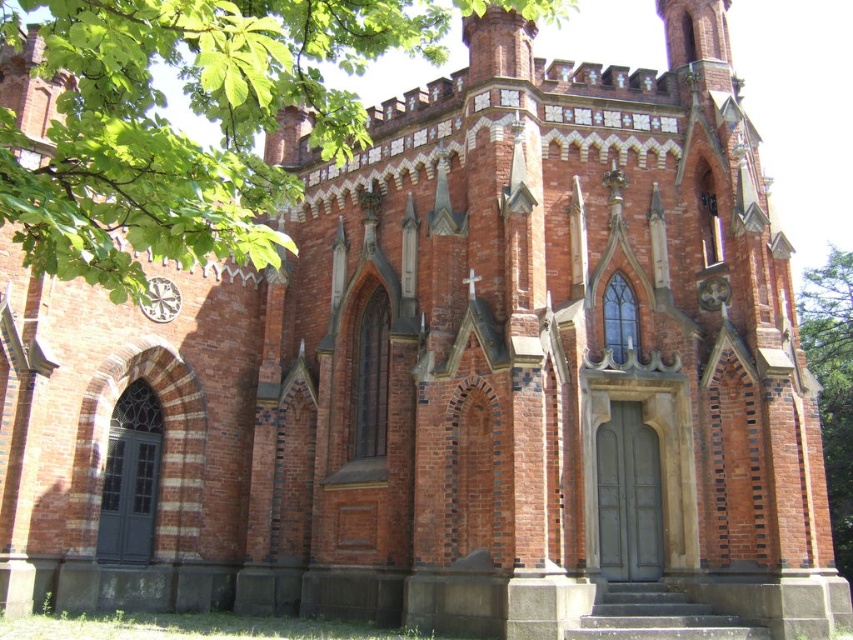
Question: Which object is closer to the camera taking this photo?

Choices:
 (A) white ceramic clock at center
 (B) green leafy tree at right
 (C) green leafy tree at upper left

Answer: (C)

Question: Based on their relative distances, which object is nearer to the green leafy tree at upper left?

Choices:
 (A) white ceramic clock at center
 (B) green leafy tree at right

Answer: (A)

Question: Does green leafy tree at upper left have a larger size compared to green leafy tree at right?

Choices:
 (A) yes
 (B) no

Answer: (A)

Question: Can you confirm if green leafy tree at upper left is positioned above white ceramic clock at center?

Choices:
 (A) no
 (B) yes

Answer: (B)

Question: Estimate the real-world distances between objects in this image. Which object is farther from the green leafy tree at right?

Choices:
 (A) green leafy tree at upper left
 (B) white ceramic clock at center

Answer: (B)

Question: Can you confirm if green leafy tree at right is positioned below white ceramic clock at center?

Choices:
 (A) yes
 (B) no

Answer: (A)